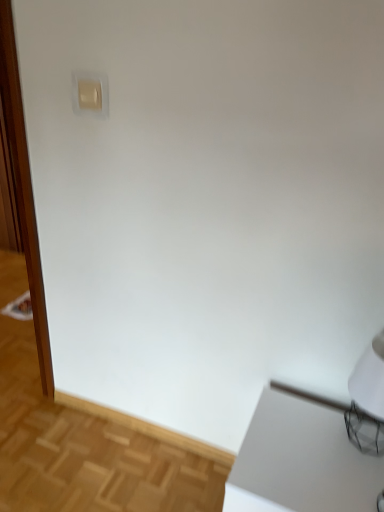
Question: Can you confirm if white glossy table at lower right is bigger than beige plastic light switch at upper left?

Choices:
 (A) yes
 (B) no

Answer: (A)

Question: Does white glossy table at lower right lie in front of beige plastic light switch at upper left?

Choices:
 (A) yes
 (B) no

Answer: (A)

Question: Is there a large distance between white glossy table at lower right and beige plastic light switch at upper left?

Choices:
 (A) no
 (B) yes

Answer: (B)

Question: Can you confirm if white glossy table at lower right is taller than beige plastic light switch at upper left?

Choices:
 (A) yes
 (B) no

Answer: (A)

Question: Does white glossy table at lower right have a lesser width compared to beige plastic light switch at upper left?

Choices:
 (A) no
 (B) yes

Answer: (A)

Question: Can you confirm if white glossy table at lower right is wider than beige plastic light switch at upper left?

Choices:
 (A) yes
 (B) no

Answer: (A)

Question: From a real-world perspective, is beige plastic light switch at upper left under white glossy table at lower right?

Choices:
 (A) yes
 (B) no

Answer: (B)

Question: Considering the relative positions of beige plastic light switch at upper left and white glossy table at lower right in the image provided, is beige plastic light switch at upper left in front of white glossy table at lower right?

Choices:
 (A) no
 (B) yes

Answer: (A)

Question: Considering the relative sizes of beige plastic light switch at upper left and white glossy table at lower right in the image provided, is beige plastic light switch at upper left shorter than white glossy table at lower right?

Choices:
 (A) yes
 (B) no

Answer: (A)

Question: Is white glossy table at lower right surrounded by beige plastic light switch at upper left?

Choices:
 (A) yes
 (B) no

Answer: (B)

Question: Does beige plastic light switch at upper left have a lesser width compared to white glossy table at lower right?

Choices:
 (A) no
 (B) yes

Answer: (B)

Question: From a real-world perspective, does beige plastic light switch at upper left stand above white glossy table at lower right?

Choices:
 (A) no
 (B) yes

Answer: (B)

Question: From a real-world perspective, is white glossy screen door at left located beneath beige plastic light switch at upper left?

Choices:
 (A) no
 (B) yes

Answer: (B)